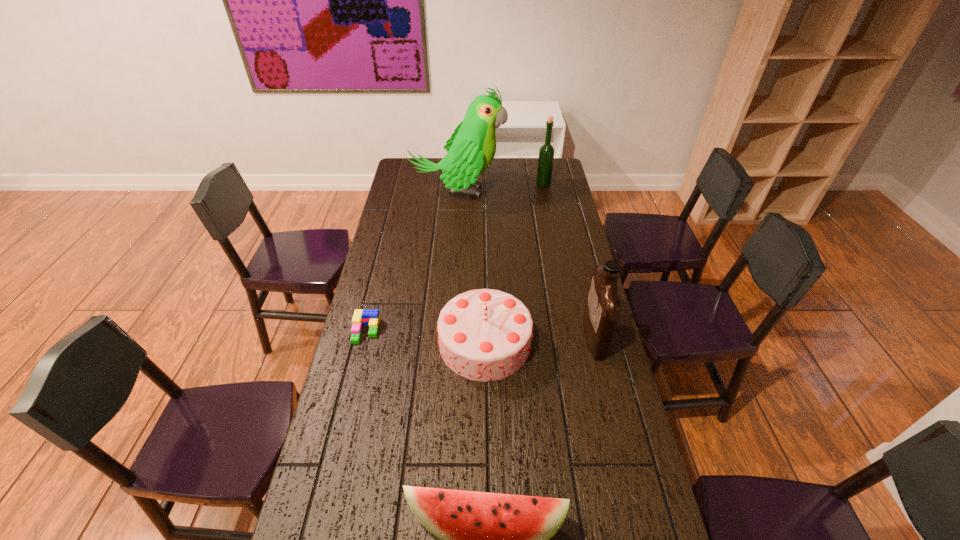
Where is `object that is at the far right corner`? The height and width of the screenshot is (540, 960). object that is at the far right corner is located at coordinates (546, 152).

Where is `vacant space at the far edge of the desktop`? Image resolution: width=960 pixels, height=540 pixels. vacant space at the far edge of the desktop is located at coordinates (433, 176).

In the image, there is a desktop. What are the coordinates of `free region at the left edge` in the screenshot? It's located at (349, 373).

Locate an element on the screen. free space at the right edge is located at coordinates (576, 231).

Where is `vacant position at the far left corner of the desktop`? This screenshot has width=960, height=540. vacant position at the far left corner of the desktop is located at coordinates (427, 176).

The image size is (960, 540). What are the coordinates of `vacant space in between the parakeet and the leftmost object` in the screenshot? It's located at pyautogui.click(x=412, y=261).

Locate an element on the screen. The height and width of the screenshot is (540, 960). empty space that is in between the birthday cake and the right liquor is located at coordinates (540, 340).

The height and width of the screenshot is (540, 960). I want to click on free spot between the parakeet and the Lego, so click(412, 261).

Where is `free space between the left liquor and the tallest object`? This screenshot has height=540, width=960. free space between the left liquor and the tallest object is located at coordinates (500, 188).

Locate an element on the screen. The height and width of the screenshot is (540, 960). vacant area that lies between the parakeet and the right liquor is located at coordinates (526, 265).